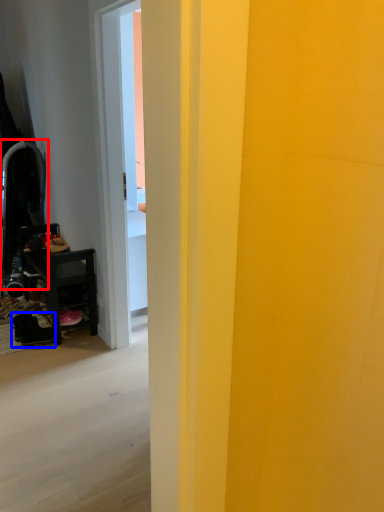
Question: Which of the following is the farthest to the observer, swivel chair (highlighted by a red box) or footwear (highlighted by a blue box)?

Choices:
 (A) swivel chair
 (B) footwear

Answer: (A)